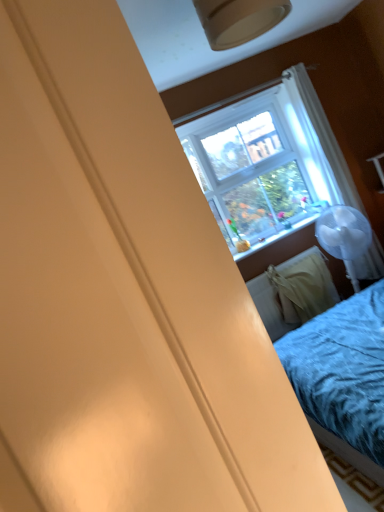
Question: From a real-world perspective, is white sheer curtain at upper right located higher than matte plastic window sill at center?

Choices:
 (A) no
 (B) yes

Answer: (B)

Question: Is matte plastic window sill at center a part of white sheer curtain at upper right?

Choices:
 (A) no
 (B) yes

Answer: (A)

Question: Is white sheer curtain at upper right shorter than matte plastic window sill at center?

Choices:
 (A) no
 (B) yes

Answer: (A)

Question: Does white sheer curtain at upper right appear on the left side of matte plastic window sill at center?

Choices:
 (A) yes
 (B) no

Answer: (B)

Question: Is white sheer curtain at upper right further to camera compared to matte plastic window sill at center?

Choices:
 (A) yes
 (B) no

Answer: (B)

Question: From their relative heights in the image, would you say white fabric radiator at lower right is taller or shorter than white sheer curtain at upper right?

Choices:
 (A) short
 (B) tall

Answer: (A)

Question: Which is correct: white fabric radiator at lower right is inside white sheer curtain at upper right, or outside of it?

Choices:
 (A) inside
 (B) outside

Answer: (B)

Question: Visually, is white fabric radiator at lower right positioned to the left or to the right of white sheer curtain at upper right?

Choices:
 (A) right
 (B) left

Answer: (B)

Question: Is white fabric radiator at lower right bigger or smaller than white sheer curtain at upper right?

Choices:
 (A) big
 (B) small

Answer: (A)

Question: In terms of size, does white sheer curtain at upper right appear bigger or smaller than matte plastic window sill at center?

Choices:
 (A) big
 (B) small

Answer: (A)

Question: Is white sheer curtain at upper right inside or outside of matte plastic window sill at center?

Choices:
 (A) inside
 (B) outside

Answer: (B)

Question: In terms of width, does white sheer curtain at upper right look wider or thinner when compared to matte plastic window sill at center?

Choices:
 (A) wide
 (B) thin

Answer: (B)

Question: From the image's perspective, relative to matte plastic window sill at center, is white sheer curtain at upper right above or below?

Choices:
 (A) above
 (B) below

Answer: (A)

Question: From the image's perspective, relative to matte plastic window sill at center, is white fabric radiator at lower right above or below?

Choices:
 (A) above
 (B) below

Answer: (B)

Question: Considering the positions of white fabric radiator at lower right and matte plastic window sill at center in the image, is white fabric radiator at lower right wider or thinner than matte plastic window sill at center?

Choices:
 (A) thin
 (B) wide

Answer: (B)